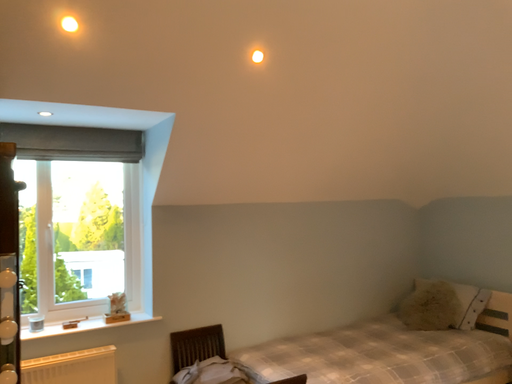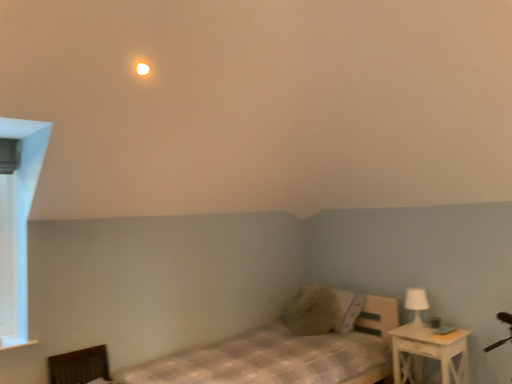
Question: Which way did the camera rotate in the video?

Choices:
 (A) rotated right
 (B) rotated left

Answer: (A)